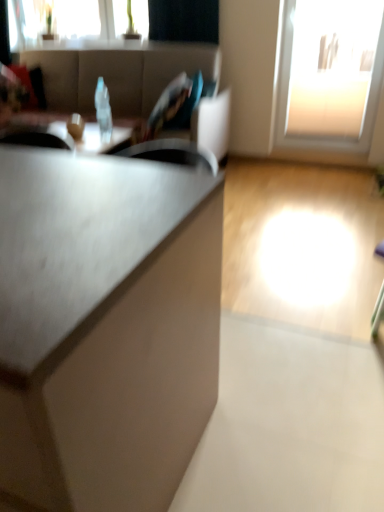
Question: Does point (119, 2) appear closer or farther from the camera than point (380, 53)?

Choices:
 (A) closer
 (B) farther

Answer: (B)

Question: Is transparent glass window at upper left, which is counted as the first window, starting from the left, to the left or to the right of transparent glass door at upper right, which is the 2th window from left to right, in the image?

Choices:
 (A) right
 (B) left

Answer: (B)

Question: Considering the real-world distances, which object is farthest from the matte gray cabinet at center?

Choices:
 (A) transparent plastic bottle at center
 (B) matte white bowl at center
 (C) transparent glass window at upper left, the 2th window from the right
 (D) matte gray couch at upper left
 (E) transparent glass door at upper right, the 1th window positioned from the bottom

Answer: (C)

Question: Estimate the real-world distances between objects in this image. Which object is closer to the matte black table at center?

Choices:
 (A) transparent plastic bottle at center
 (B) transparent glass window at upper left, which is counted as the first window, starting from the left
 (C) matte gray cabinet at center
 (D) transparent glass door at upper right, which is the second window in top-to-bottom order
 (E) matte gray couch at upper left

Answer: (A)